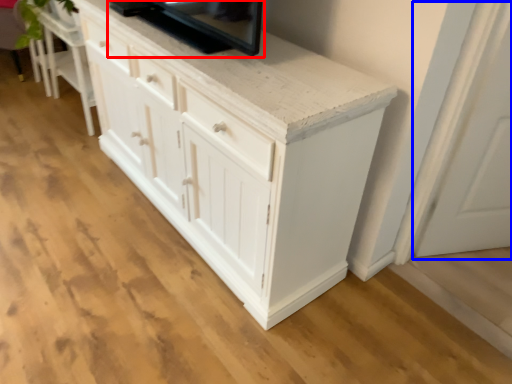
Question: Which object appears farthest to the camera in this image, appliance (highlighted by a red box) or glass door (highlighted by a blue box)?

Choices:
 (A) appliance
 (B) glass door

Answer: (B)